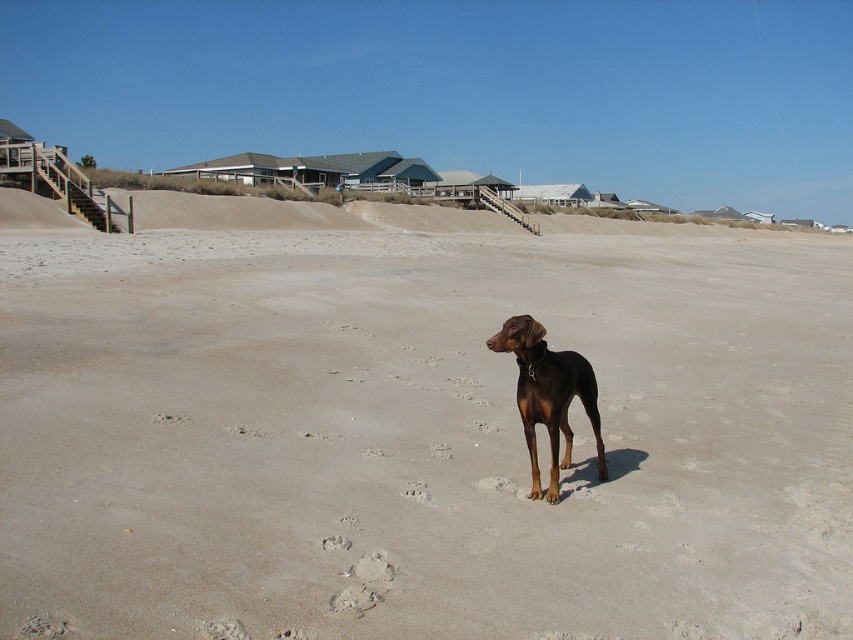
You are standing on the beach and see the brown sand at center marked by point (415, 424). If you walk straight towards the point, will you reach the Doberman Pinscher before the sand?

The point (415, 424) marks the brown sand at center, so walking straight towards it would lead you to the sand first, not the Doberman Pinscher.

You are a photographer trying to capture the entire brown glossy dog at center and the brown sand at center in a single shot. Based on the scene, can you fit both objects in the frame without cropping either of them?

The brown sand at center is wider than the brown glossy dog at center, so yes, both can be captured in the frame since the sand provides enough space around the dog.